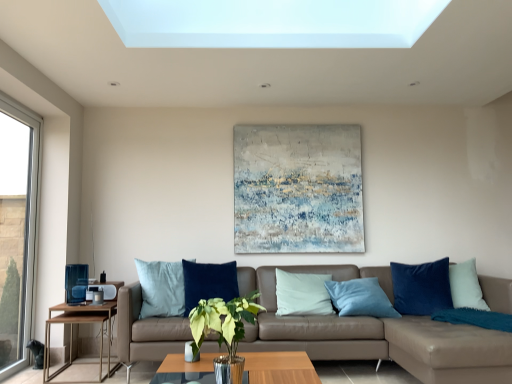
Question: Is leather couch at center turned away from green leafy plant in glass vase at center?

Choices:
 (A) no
 (B) yes

Answer: (A)

Question: From the image's perspective, does leather couch at center appear higher than green leafy plant in glass vase at center?

Choices:
 (A) yes
 (B) no

Answer: (B)

Question: Considering the relative sizes of leather couch at center and green leafy plant in glass vase at center in the image provided, is leather couch at center thinner than green leafy plant in glass vase at center?

Choices:
 (A) yes
 (B) no

Answer: (B)

Question: Does leather couch at center have a larger size compared to green leafy plant in glass vase at center?

Choices:
 (A) yes
 (B) no

Answer: (A)

Question: Would you say leather couch at center is outside green leafy plant in glass vase at center?

Choices:
 (A) no
 (B) yes

Answer: (B)

Question: From the image's perspective, is leather couch at center under green leafy plant in glass vase at center?

Choices:
 (A) yes
 (B) no

Answer: (A)

Question: Does wooden/metallic side table at left lie behind velvet blue pillow at right?

Choices:
 (A) no
 (B) yes

Answer: (A)

Question: Would you say wooden/metallic side table at left is a long distance from velvet blue pillow at right?

Choices:
 (A) no
 (B) yes

Answer: (B)

Question: Does wooden/metallic side table at left appear on the left side of velvet blue pillow at right?

Choices:
 (A) no
 (B) yes

Answer: (B)

Question: Would you say velvet blue pillow at right is part of wooden/metallic side table at left's contents?

Choices:
 (A) no
 (B) yes

Answer: (A)

Question: Is wooden/metallic side table at left looking in the opposite direction of velvet blue pillow at right?

Choices:
 (A) no
 (B) yes

Answer: (A)

Question: Can you confirm if wooden/metallic side table at left is taller than velvet blue pillow at right?

Choices:
 (A) no
 (B) yes

Answer: (A)

Question: Is the position of wooden/metallic side table at left less distant than that of clear glass window at left?

Choices:
 (A) no
 (B) yes

Answer: (A)